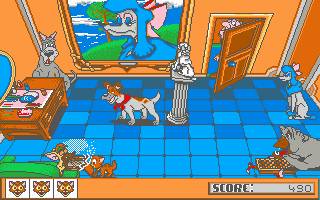
Locate an element on the screen. Image resolution: width=320 pixels, height=200 pixels. table is located at coordinates (51, 86).